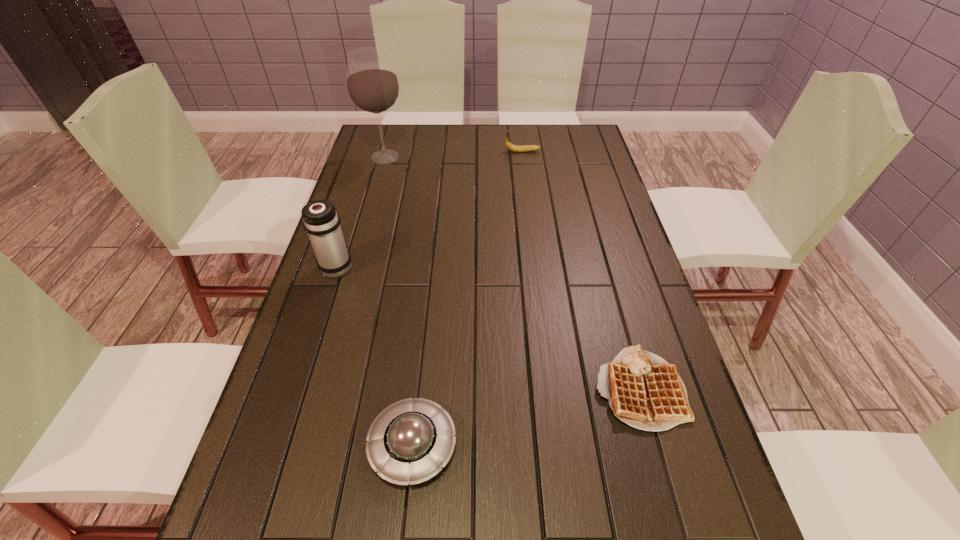
Identify the location of object that is at the right edge. (644, 391).

Locate an element on the screen. The image size is (960, 540). object at the far left corner is located at coordinates (372, 84).

The image size is (960, 540). Identify the location of free spot at the far edge of the desktop. (450, 125).

Locate an element on the screen. This screenshot has height=540, width=960. vacant area at the left edge is located at coordinates (303, 347).

The height and width of the screenshot is (540, 960). In order to click on vacant area at the right edge in this screenshot , I will do `click(588, 248)`.

The height and width of the screenshot is (540, 960). In the image, there is a desktop. Find the location of `vacant space at the far left corner`. vacant space at the far left corner is located at coordinates (399, 134).

Find the location of a particular element. This screenshot has height=540, width=960. free space between the fourth object from left to right and the waffle is located at coordinates (581, 270).

Find the location of a particular element. This screenshot has width=960, height=540. vacant region between the tallest object and the thermos bottle is located at coordinates point(361,212).

What are the coordinates of `empty space that is in between the alcohol and the banana` in the screenshot? It's located at (454, 154).

Identify the location of vacant area that lies between the second tallest object and the third object from left to right. The image size is (960, 540). (375, 355).